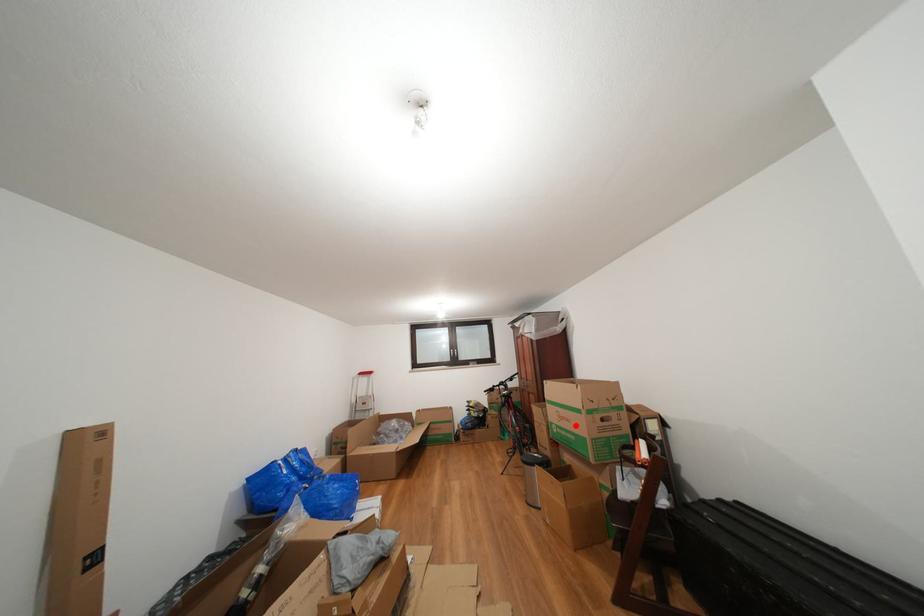
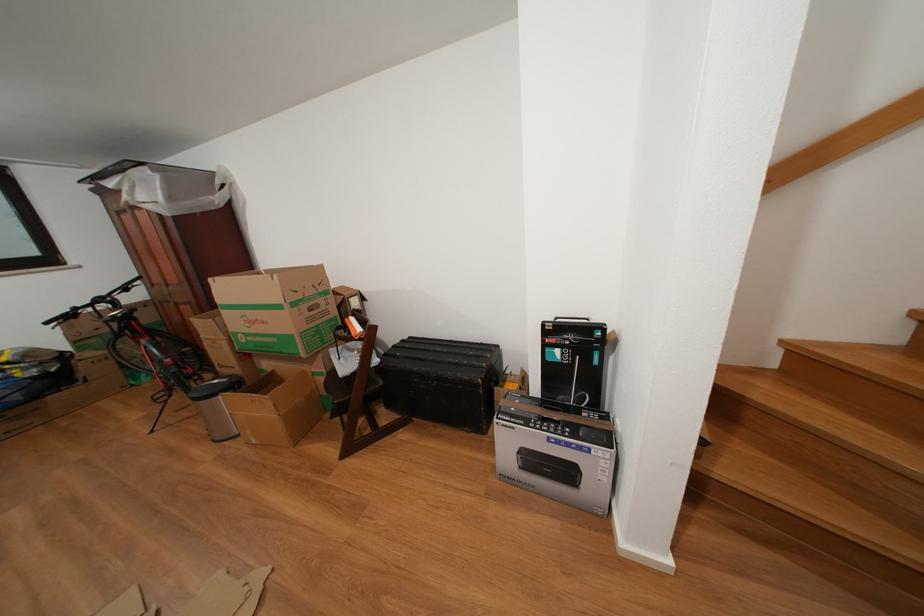
Where in the second image is the point corresponding to the highlighted location from the first image?

(272, 328)